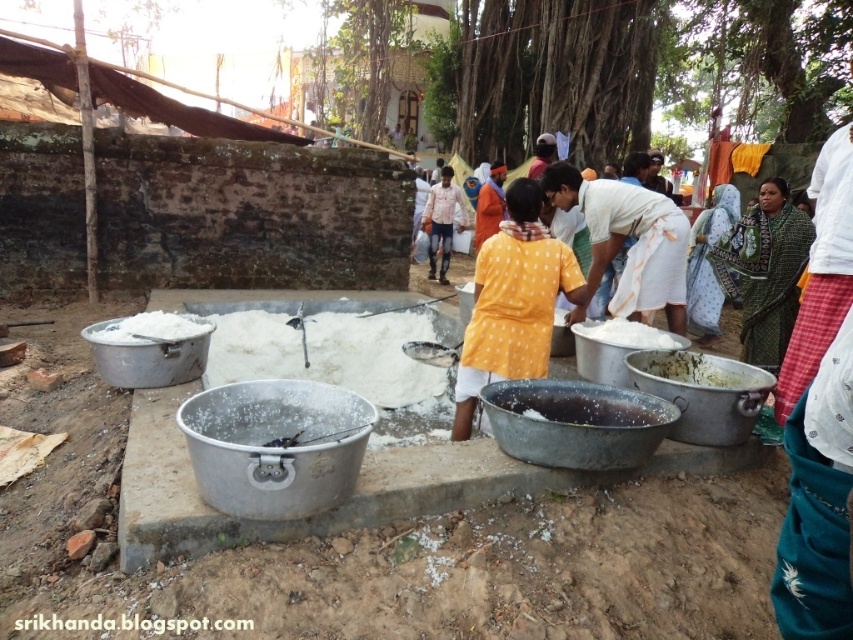
Question: Is white matte food at center behind white powdery substance at center?

Choices:
 (A) no
 (B) yes

Answer: (A)

Question: Which object appears closest to the camera in this image?

Choices:
 (A) blue printed saree at center
 (B) green patterned cloth at right
 (C) white matte bowl at center

Answer: (C)

Question: Based on their relative distances, which object is farther from the white matte bowl at center?

Choices:
 (A) white powdery substance at center
 (B) yellow dotted shirt at center
 (C) white matte food at center
 (D) green patterned cloth at right

Answer: (D)

Question: Can you confirm if white matte bowl at center is smaller than white cotton shirt at center?

Choices:
 (A) no
 (B) yes

Answer: (B)

Question: Can you confirm if blue printed saree at center is wider than white matte salt at center?

Choices:
 (A) yes
 (B) no

Answer: (A)

Question: Among these objects, which one is nearest to the camera?

Choices:
 (A) white powdery substance at center
 (B) white matte salt at center
 (C) white matte food at center
 (D) green patterned cloth at right

Answer: (C)